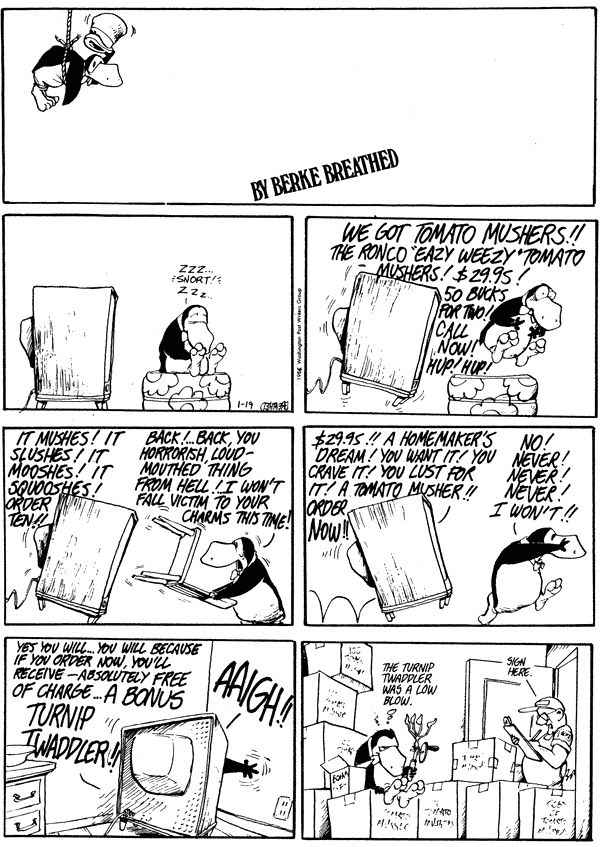
Where is `tvs`? This screenshot has height=847, width=600. tvs is located at coordinates (154, 792), (81, 560), (381, 563), (376, 346), (89, 333).